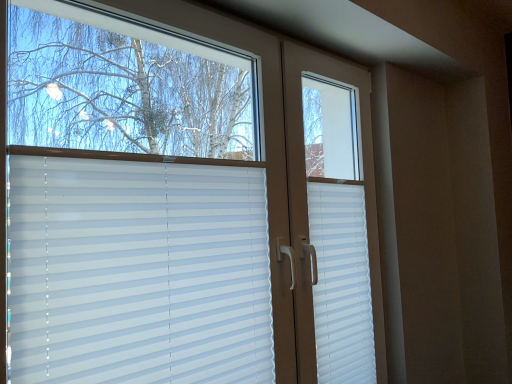
Locate an element on the screen. This screenshot has width=512, height=384. white plastic shutter at right is located at coordinates (341, 284).

The image size is (512, 384). In order to click on white plastic blinds at center in this screenshot , I will do `click(184, 202)`.

Locate an element on the screen. The height and width of the screenshot is (384, 512). white plastic shutter at right is located at coordinates (341, 284).

Is white plastic shutter at right surrounded by white plastic blinds at center?

No, white plastic shutter at right is not surrounded by white plastic blinds at center.

Identify the location of shutter beneath the white plastic blinds at center (from a real-world perspective). This screenshot has height=384, width=512. (341, 284).

Does white plastic blinds at center come in front of white plastic shutter at right?

Yes.

Is point (139, 202) closer or farther from the camera than point (350, 307)?

Point (139, 202) appears to be closer to the viewer than point (350, 307).

Between point (359, 169) and point (340, 246), which one is positioned behind?

The point (359, 169) is farther from the camera.

Which object is wider, white plastic blinds at center or white plastic shutter at right?

Wider between the two is white plastic blinds at center.

Which is correct: white plastic blinds at center is inside white plastic shutter at right, or outside of it?

white plastic blinds at center is not inside white plastic shutter at right, it's outside.

Is white plastic blinds at center in contact with white plastic shutter at right?

No.

Which is behind, white plastic shutter at right or white plastic blinds at center?

white plastic shutter at right is further from the camera.

You are a GUI agent. You are given a task and a screenshot of the screen. Output one action in this format:
    pyautogui.click(x=<x>, y=<y>)
    Task: Click on the window blind that is in front of the white plastic shutter at right
    The image size is (512, 384).
    Given the screenshot: What is the action you would take?
    pyautogui.click(x=138, y=273)

Is white plastic shutter at right wider than white plastic blinds at center?

No.

Is white plastic blinds at center touching white plastic blinds at center?

They are not placed beside each other.

Based on the photo, considering the sizes of objects white plastic blinds at center and white plastic blinds at center in the image provided, who is smaller, white plastic blinds at center or white plastic blinds at center?

white plastic blinds at center is smaller.

From the image's perspective, does white plastic blinds at center appear lower than white plastic blinds at center?

Yes, from the image's perspective, white plastic blinds at center is below white plastic blinds at center.

Considering the points (15, 206) and (324, 291), which point is behind, point (15, 206) or point (324, 291)?

Point (324, 291)

Looking at their sizes, would you say white plastic blinds at center is wider or thinner than white plastic blinds at center?

In the image, white plastic blinds at center appears to be wider than white plastic blinds at center.

Does point (108, 5) come in front of point (19, 171)?

No.

From the image's perspective, between white plastic blinds at center and white plastic blinds at center, who is located below?

white plastic blinds at center, from the image's perspective.

In the scene shown: Looking at their sizes, would you say white plastic shutter at right is wider or thinner than white plastic blinds at center?

Clearly, white plastic shutter at right has less width compared to white plastic blinds at center.

From the picture: Are white plastic shutter at right and white plastic blinds at center beside each other?

There is a gap between white plastic shutter at right and white plastic blinds at center.

Considering the relative sizes of white plastic shutter at right and white plastic blinds at center in the image provided, is white plastic shutter at right shorter than white plastic blinds at center?

Indeed, white plastic shutter at right has a lesser height compared to white plastic blinds at center.

From a real-world perspective, which object stands above the other?

white plastic blinds at center.

Image resolution: width=512 pixels, height=384 pixels. What are the coordinates of `shutter beneath the white plastic blinds at center (from a real-world perspective)` in the screenshot? It's located at (341, 284).

In order to click on shutter that is below the white plastic blinds at center (from the image's perspective) in this screenshot , I will do `click(341, 284)`.

In the scene shown: From the image, which object appears to be nearer to white plastic blinds at center, white plastic blinds at center or white plastic shutter at right?

white plastic blinds at center.

Which object lies nearer to the anchor point white plastic blinds at center, white plastic shutter at right or white plastic blinds at center?

Based on the image, white plastic blinds at center appears to be nearer to white plastic blinds at center.

From the image, which object appears to be nearer to white plastic shutter at right, white plastic blinds at center or white plastic blinds at center?

Based on the image, white plastic blinds at center appears to be nearer to white plastic shutter at right.

Based on their spatial positions, is white plastic shutter at right or white plastic blinds at center closer to white plastic blinds at center?

white plastic blinds at center lies closer to white plastic blinds at center than the other object.

From the image, which object appears to be farther from white plastic blinds at center, white plastic blinds at center or white plastic shutter at right?

white plastic shutter at right is further to white plastic blinds at center.

Looking at the image, which one is located further to white plastic shutter at right, white plastic blinds at center or white plastic blinds at center?

white plastic blinds at center is positioned further to the anchor white plastic shutter at right.

Find the location of a particular element. The height and width of the screenshot is (384, 512). window blind located between white plastic blinds at center and white plastic shutter at right in the depth direction is located at coordinates (138, 273).